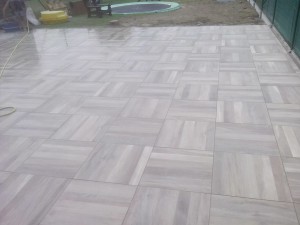
This screenshot has height=225, width=300. Find the location of `cord`. cord is located at coordinates pos(15,109).